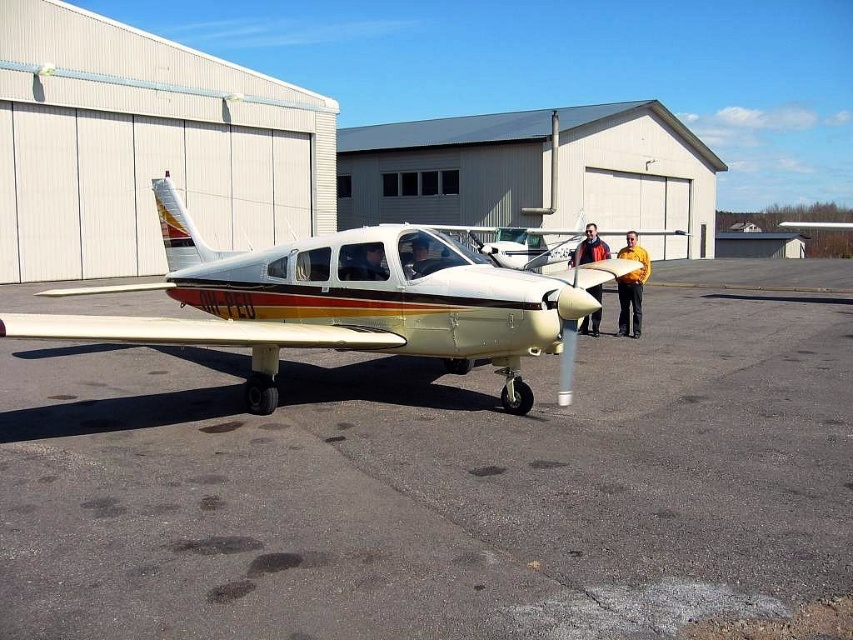
You are standing on the airfield tarmac and see two points marked on the image. Which point is closer to you, point (569, 230) or point (352, 264)?

Point (569, 230) is further to the viewer than point (352, 264), so the closer point is point (352, 264).

You are a pilot preparing to board your aircraft. You notice a gold metallic airplane at center and a matte black helmet at center. Which object is positioned to the right side from your perspective?

The gold metallic airplane at center is positioned to the right of the matte black helmet at center.

You are standing in front of the gold metallic airplane at center and the orange fabric jacket at center. Which object is closer to your right side?

The orange fabric jacket at center is closer to your right side because the gold metallic airplane at center is to the left of it.